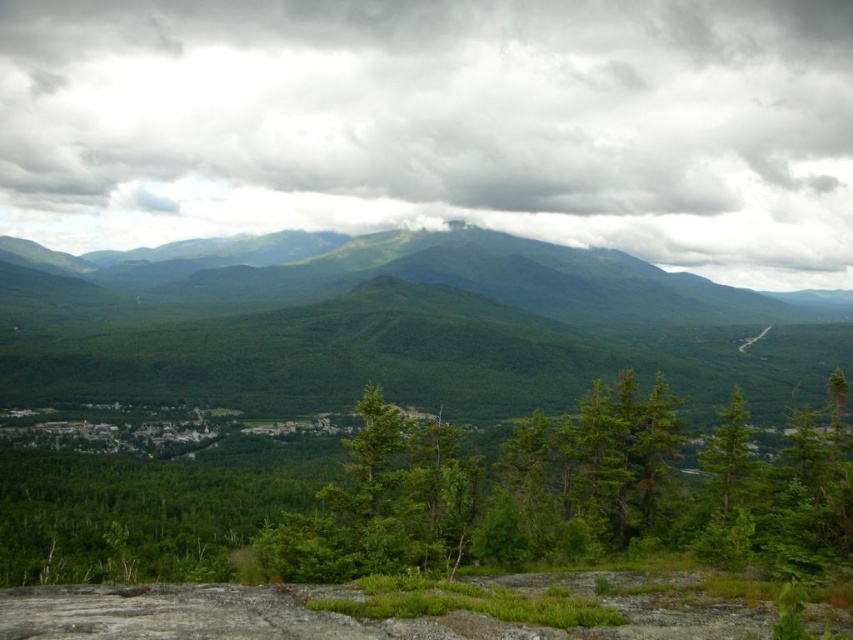
Does point (380, 164) come behind point (550, 438)?

Yes, point (380, 164) is behind point (550, 438).

Is cloudy sky at upper center shorter than green matte tree at center?

In fact, cloudy sky at upper center may be taller than green matte tree at center.

Who is more distant from viewer, (262, 156) or (552, 448)?

The point (262, 156) is more distant.

Identify the location of cloudy sky at upper center. Image resolution: width=853 pixels, height=640 pixels. point(439,124).